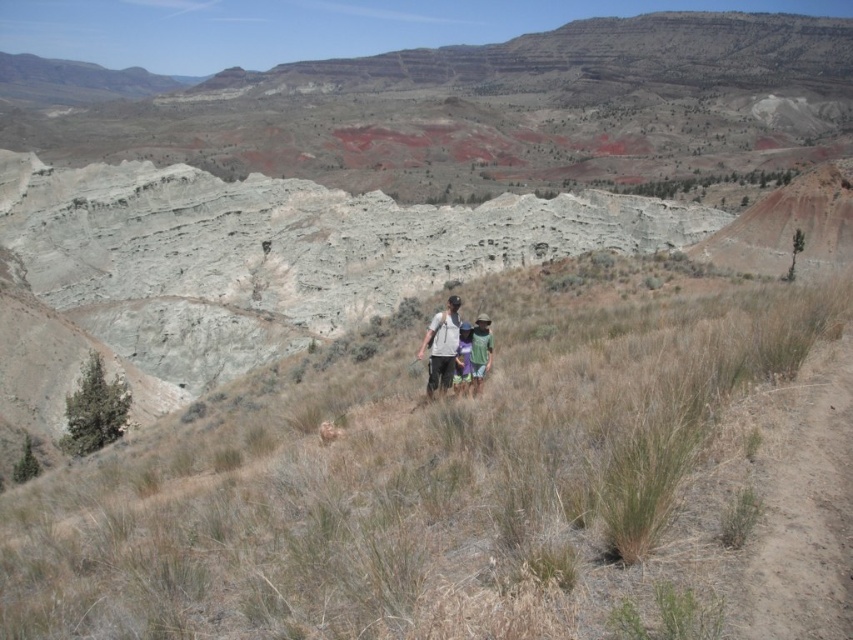
Question: Estimate the real-world distances between objects in this image. Which object is farther from the green fabric shirt at center?

Choices:
 (A) dry grass at center
 (B) light gray fabric shirt at center

Answer: (A)

Question: Which object appears closest to the camera in this image?

Choices:
 (A) green fabric shirt at center
 (B) light gray fabric shirt at center

Answer: (A)

Question: Which object is positioned farthest from the green fabric shirt at center?

Choices:
 (A) dry grass at center
 (B) light gray fabric shirt at center

Answer: (A)

Question: From the image, what is the correct spatial relationship of dry grass at center in relation to light gray fabric shirt at center?

Choices:
 (A) below
 (B) above

Answer: (A)

Question: Is dry grass at center positioned before green fabric shirt at center?

Choices:
 (A) no
 (B) yes

Answer: (B)

Question: Can you confirm if dry grass at center is bigger than light gray fabric shirt at center?

Choices:
 (A) yes
 (B) no

Answer: (A)